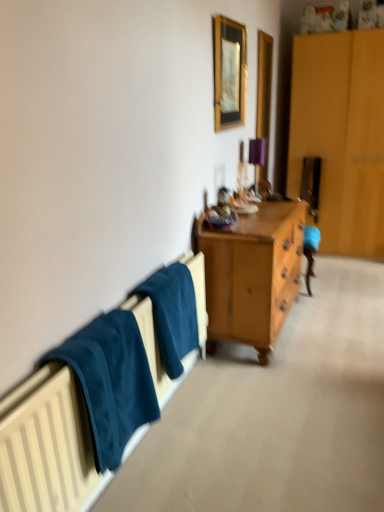
Question: From a real-world perspective, is teal fabric towel at lower left located beneath wooden picture frame at upper center?

Choices:
 (A) yes
 (B) no

Answer: (A)

Question: Does teal fabric towel at lower left have a smaller size compared to wooden picture frame at upper center?

Choices:
 (A) yes
 (B) no

Answer: (B)

Question: Considering the relative sizes of teal fabric towel at lower left and wooden picture frame at upper center in the image provided, is teal fabric towel at lower left bigger than wooden picture frame at upper center?

Choices:
 (A) yes
 (B) no

Answer: (A)

Question: From a real-world perspective, is teal fabric towel at lower left located higher than wooden picture frame at upper center?

Choices:
 (A) no
 (B) yes

Answer: (A)

Question: Is wooden picture frame at upper center a part of teal fabric towel at lower left?

Choices:
 (A) no
 (B) yes

Answer: (A)

Question: Is teal fabric towel at lower left facing away from wooden picture frame at upper center?

Choices:
 (A) no
 (B) yes

Answer: (A)

Question: Is teal fabric towel at lower left facing towards dark blue fabric at left?

Choices:
 (A) no
 (B) yes

Answer: (A)

Question: From a real-world perspective, is teal fabric towel at lower left physically below dark blue fabric at left?

Choices:
 (A) yes
 (B) no

Answer: (B)

Question: Is the depth of teal fabric towel at lower left greater than that of dark blue fabric at left?

Choices:
 (A) yes
 (B) no

Answer: (A)

Question: From a real-world perspective, is teal fabric towel at lower left on dark blue fabric at left?

Choices:
 (A) yes
 (B) no

Answer: (A)

Question: Does teal fabric towel at lower left have a greater width compared to dark blue fabric at left?

Choices:
 (A) yes
 (B) no

Answer: (A)

Question: Does teal fabric towel at lower left have a lesser height compared to dark blue fabric at left?

Choices:
 (A) no
 (B) yes

Answer: (A)

Question: Considering the relative sizes of wooden picture frame at upper center and dark blue fabric at left in the image provided, is wooden picture frame at upper center smaller than dark blue fabric at left?

Choices:
 (A) yes
 (B) no

Answer: (A)